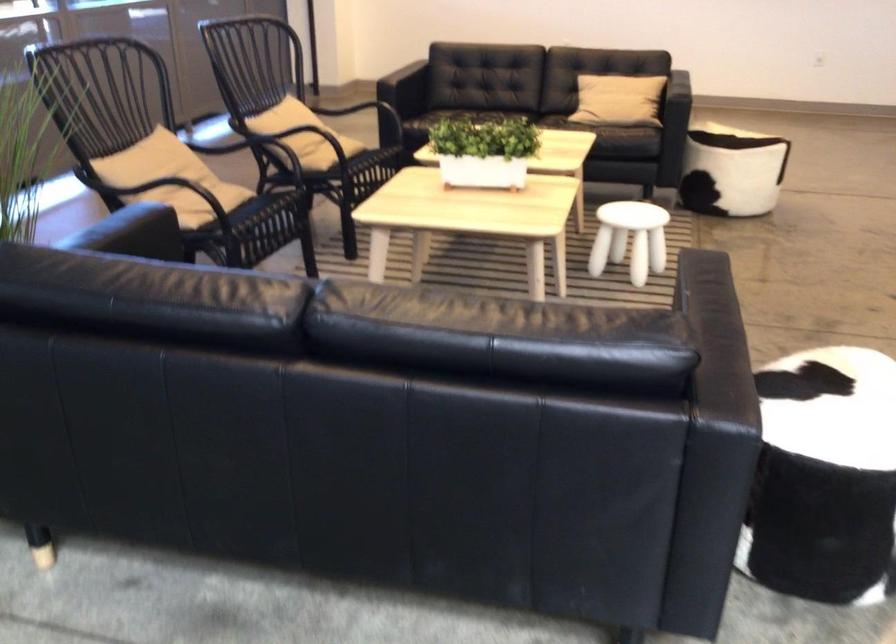
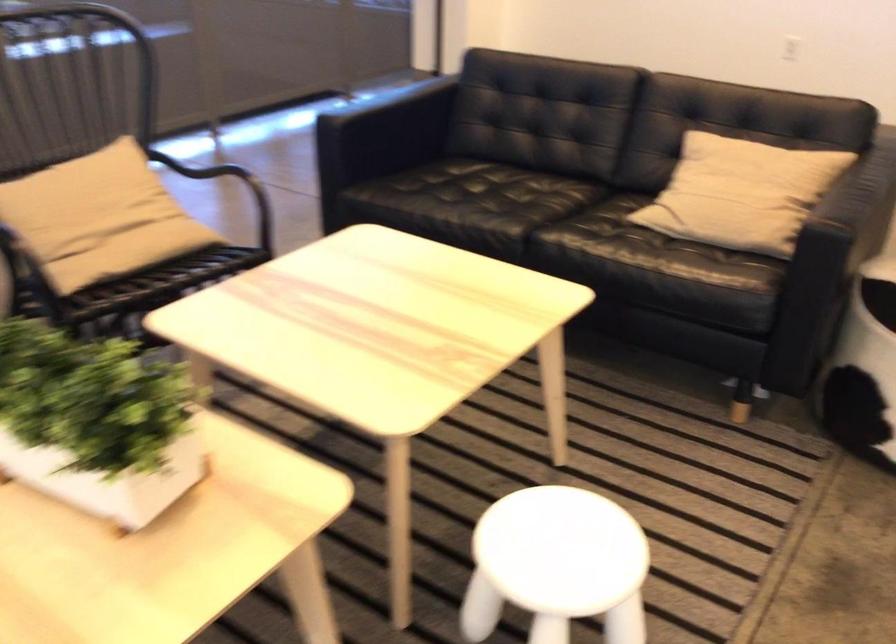
In the second image, find the point that corresponds to [513,140] in the first image.

(96, 422)